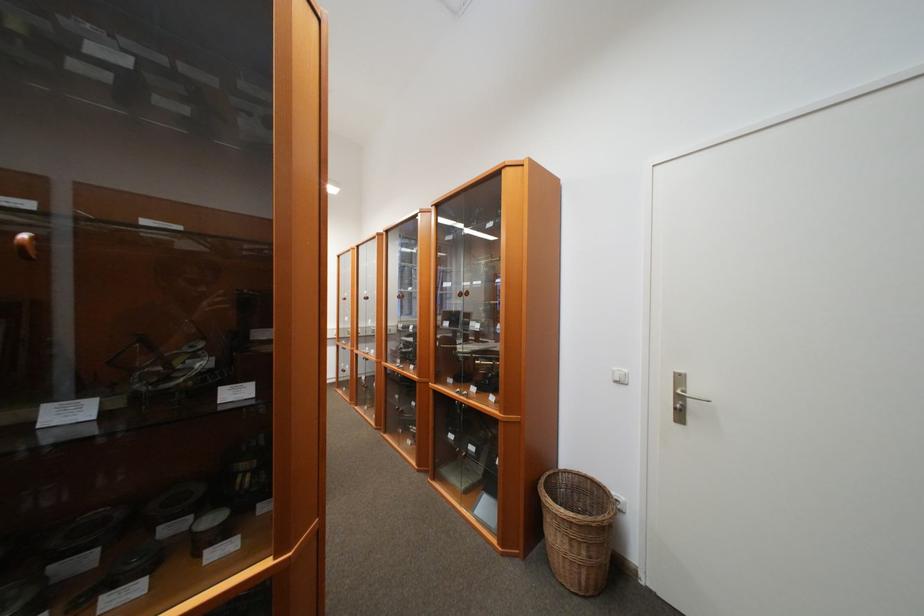
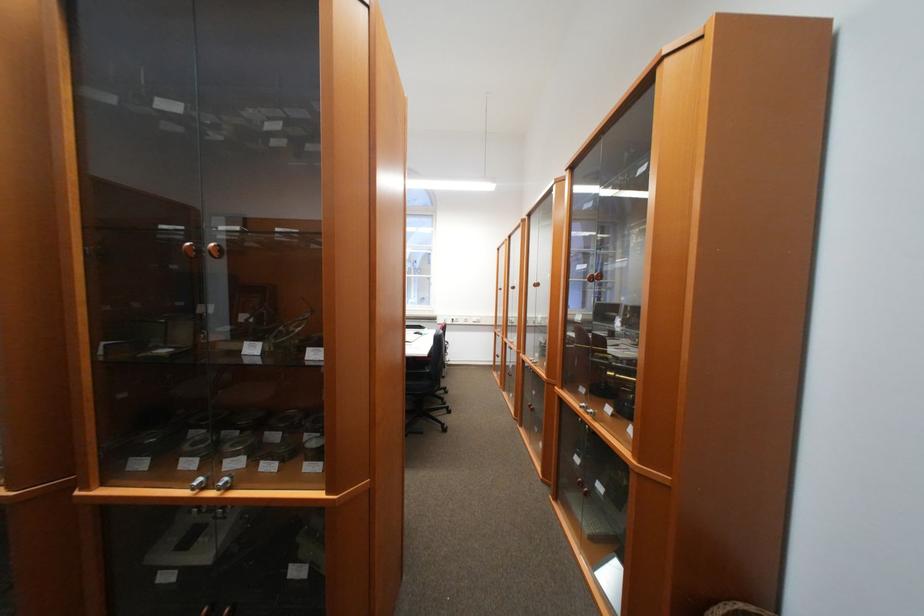
Question: The camera is either moving clockwise (left) or counter-clockwise (right) around the object. The first image is from the beginning of the video and the second image is from the end. Is the camera moving left or right when shooting the video?

Choices:
 (A) Left
 (B) Right

Answer: (B)